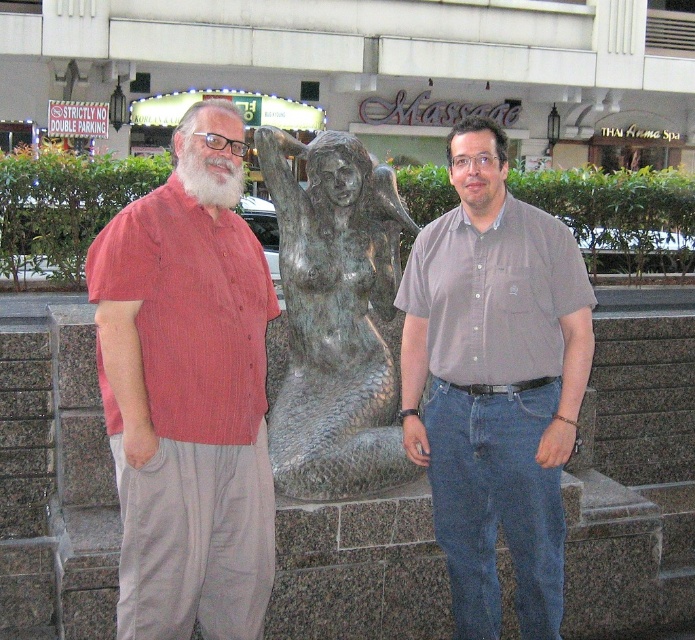
Is matte gray shirt at center behind white matte beard at center?

No, matte gray shirt at center is closer to the viewer.

Who is more forward, (530, 339) or (489, 189)?

Point (530, 339) is more forward.

Where is `matte gray shirt at center`? Image resolution: width=695 pixels, height=640 pixels. matte gray shirt at center is located at coordinates (496, 401).

The image size is (695, 640). What are the coordinates of `matte gray shirt at center` in the screenshot? It's located at (496, 401).

Is bronze statue at center taller than white matte beard at center?

Yes.

Is bronze statue at center closer to camera compared to white matte beard at center?

No, it is not.

Who is more forward, (288, 221) or (493, 172)?

Positioned in front is point (493, 172).

Where is `bronze statue at center`? The image size is (695, 640). bronze statue at center is located at coordinates (336, 317).

Can you confirm if red striped shirt at left is shorter than bronze statue at center?

In fact, red striped shirt at left may be taller than bronze statue at center.

This screenshot has height=640, width=695. What do you see at coordinates (186, 413) in the screenshot? I see `red striped shirt at left` at bounding box center [186, 413].

Is point (111, 330) more distant than point (313, 196)?

No, (111, 330) is closer to viewer.

Locate an element on the screen. Image resolution: width=695 pixels, height=640 pixels. red striped shirt at left is located at coordinates (186, 413).